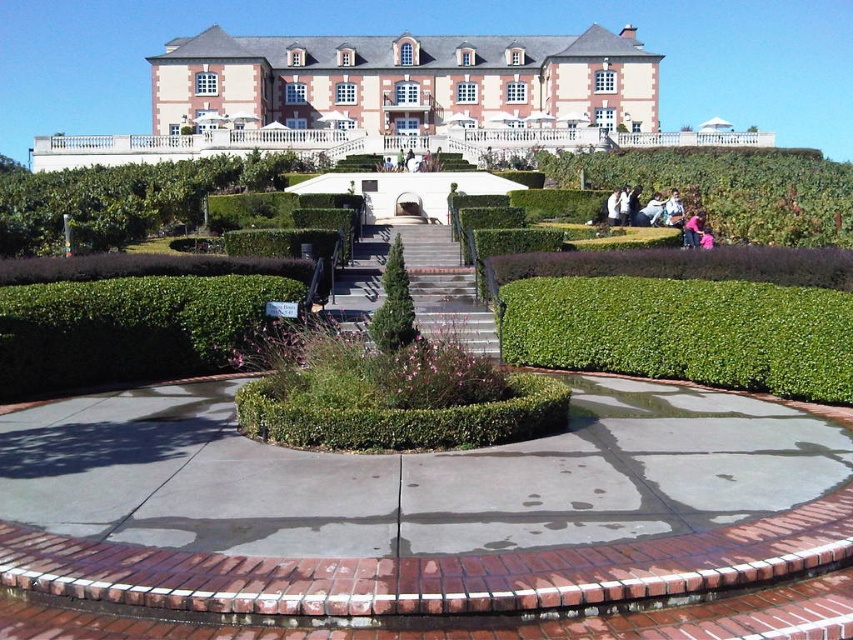
Question: Where is green leafy hedge at center located in relation to pink fabric at lower right in the image?

Choices:
 (A) below
 (B) above

Answer: (A)

Question: Which point is farther from the camera taking this photo?

Choices:
 (A) (695, 225)
 (B) (392, 337)
 (C) (762, 214)
 (D) (666, 221)

Answer: (D)

Question: Is matte pink and white palace at upper center to the right of light blue denim jacket at lower right from the viewer's perspective?

Choices:
 (A) yes
 (B) no

Answer: (B)

Question: Which object is the farthest from the light blue denim jacket at lower right?

Choices:
 (A) green leafy hedge at center right
 (B) green textured bush at center

Answer: (B)

Question: Can you confirm if matte pink and white palace at upper center is positioned to the right of light blue denim jacket at lower right?

Choices:
 (A) no
 (B) yes

Answer: (A)

Question: Which object appears closest to the camera in this image?

Choices:
 (A) green textured bush at center
 (B) green leafy hedge at center right

Answer: (A)